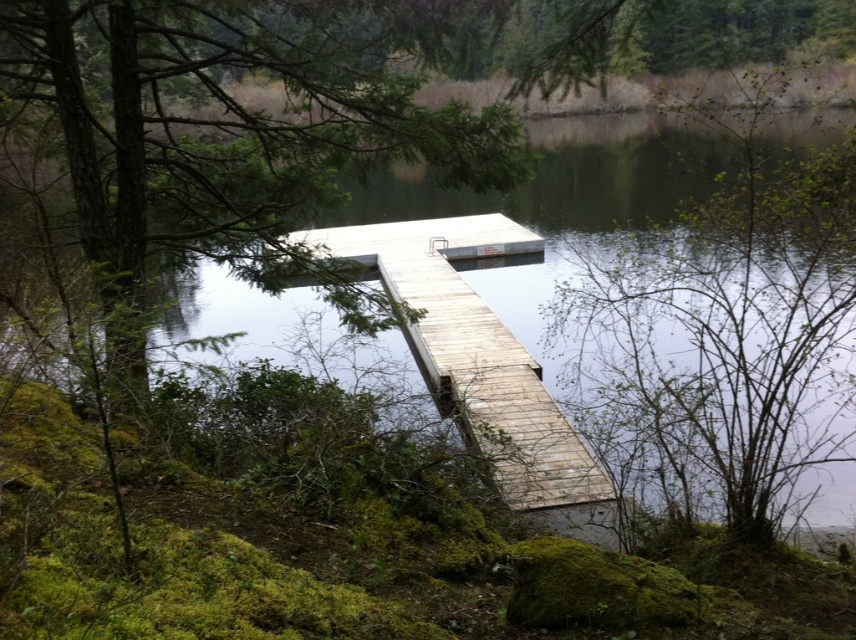
From the picture: Which is below, transparent water at center or wooden dock at center?

wooden dock at center

The image size is (856, 640). What do you see at coordinates (562, 198) in the screenshot?
I see `transparent water at center` at bounding box center [562, 198].

Where is `transparent water at center`? transparent water at center is located at coordinates (562, 198).

Is green leafy tree at upper right above wooden dock at center?

Correct, green leafy tree at upper right is located above wooden dock at center.

Is point (655, 252) farther from viewer compared to point (524, 436)?

No, it is not.

Does point (724, 502) come closer to viewer compared to point (580, 524)?

That is True.

Find the location of a particular element. green leafy tree at upper right is located at coordinates (723, 330).

Can you confirm if green leafy tree at upper right is bigger than transparent water at center?

No.

Based on the photo, does green leafy tree at upper right have a smaller size compared to transparent water at center?

Correct, green leafy tree at upper right occupies less space than transparent water at center.

Find the location of a particular element. The height and width of the screenshot is (640, 856). green leafy tree at upper right is located at coordinates (723, 330).